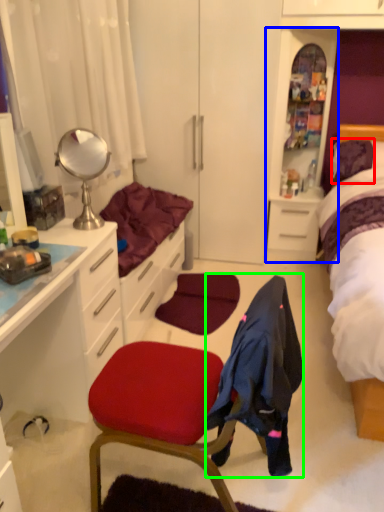
Question: Which object is positioned closest to pillow (highlighted by a red box)? Select from file cabinet (highlighted by a blue box) and clothing (highlighted by a green box).

Choices:
 (A) file cabinet
 (B) clothing

Answer: (A)